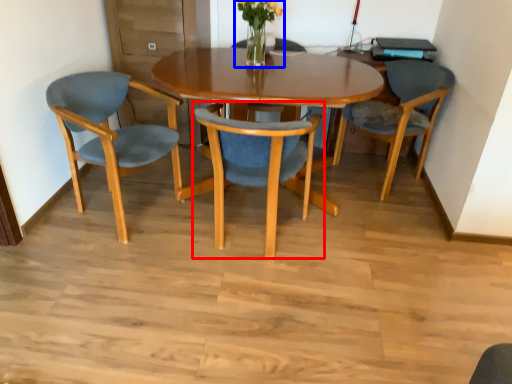
Question: Which point is further to the camera, chair (highlighted by a red box) or floral arrangement (highlighted by a blue box)?

Choices:
 (A) chair
 (B) floral arrangement

Answer: (B)